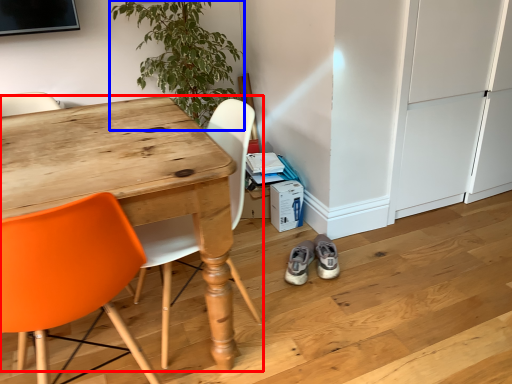
Question: Which object appears farthest to the camera in this image, desk (highlighted by a red box) or houseplant (highlighted by a blue box)?

Choices:
 (A) desk
 (B) houseplant

Answer: (B)